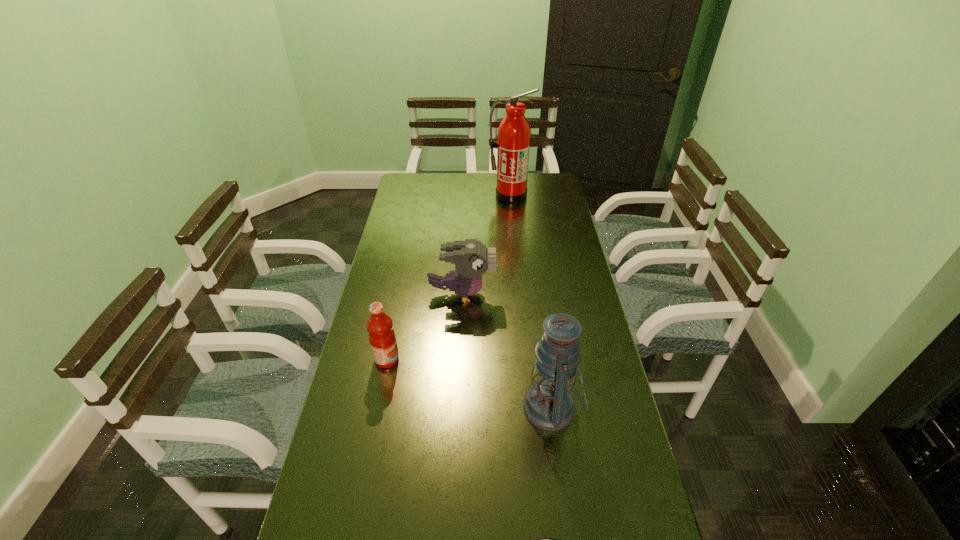
Identify the location of free region located on the front-facing side of the second nearest object. (421, 407).

The height and width of the screenshot is (540, 960). Identify the location of free space located on the front label of the fruit juice. (482, 360).

I want to click on free space located 0.250m at the beak of the bird, so click(x=565, y=294).

I want to click on object positioned at the far edge, so click(514, 133).

Locate an element on the screen. This screenshot has height=540, width=960. object at the left edge is located at coordinates (382, 338).

This screenshot has width=960, height=540. In order to click on fire extinguisher that is at the right edge in this screenshot , I will do `click(514, 133)`.

The width and height of the screenshot is (960, 540). Find the location of `lantern present at the right edge`. lantern present at the right edge is located at coordinates (548, 404).

At what (x,y) coordinates should I click in order to perform the action: click on object that is at the far right corner. Please return your answer as a coordinate pair (x, y). This screenshot has width=960, height=540. Looking at the image, I should click on (514, 133).

Locate an element on the screen. vacant space at the far edge of the desktop is located at coordinates (448, 176).

In the image, there is a desktop. Where is `blank space at the left edge`? The height and width of the screenshot is (540, 960). blank space at the left edge is located at coordinates (348, 533).